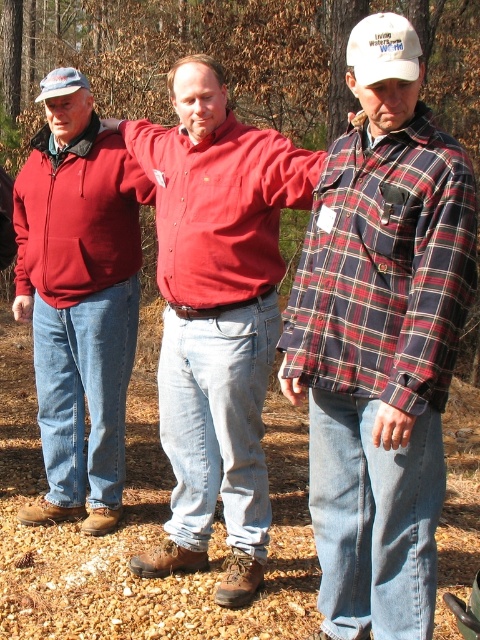
Question: Can you confirm if matte red jacket at left is smaller than matte blue baseball cap at upper left?

Choices:
 (A) yes
 (B) no

Answer: (B)

Question: Which of the following is the farthest from the observer?

Choices:
 (A) (372, 77)
 (B) (188, 566)
 (C) (43, 88)
 (D) (63, 380)

Answer: (D)

Question: Is plaid flannel shirt at right positioned behind matte blue baseball cap at upper left?

Choices:
 (A) no
 (B) yes

Answer: (A)

Question: Which point is closer to the camera taking this photo?

Choices:
 (A) (262, 211)
 (B) (358, 42)
 (C) (68, 497)
 (D) (50, 83)

Answer: (B)

Question: Is matte red shirt at center wider than white cotton cap at upper right?

Choices:
 (A) no
 (B) yes

Answer: (B)

Question: Estimate the real-world distances between objects in this image. Which object is closer to the white cotton cap at upper right?

Choices:
 (A) matte red jacket at left
 (B) matte red shirt at center
 (C) matte blue baseball cap at upper left

Answer: (B)